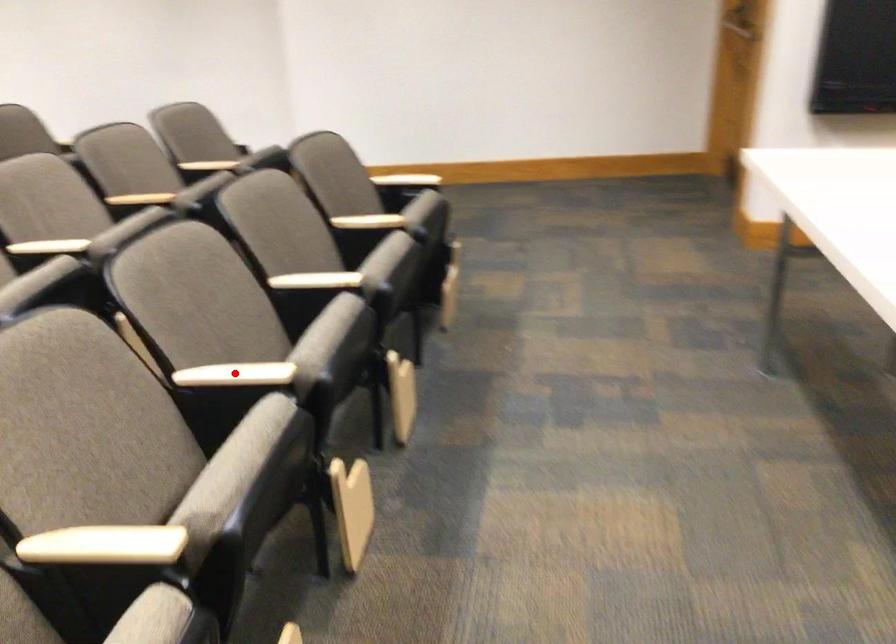
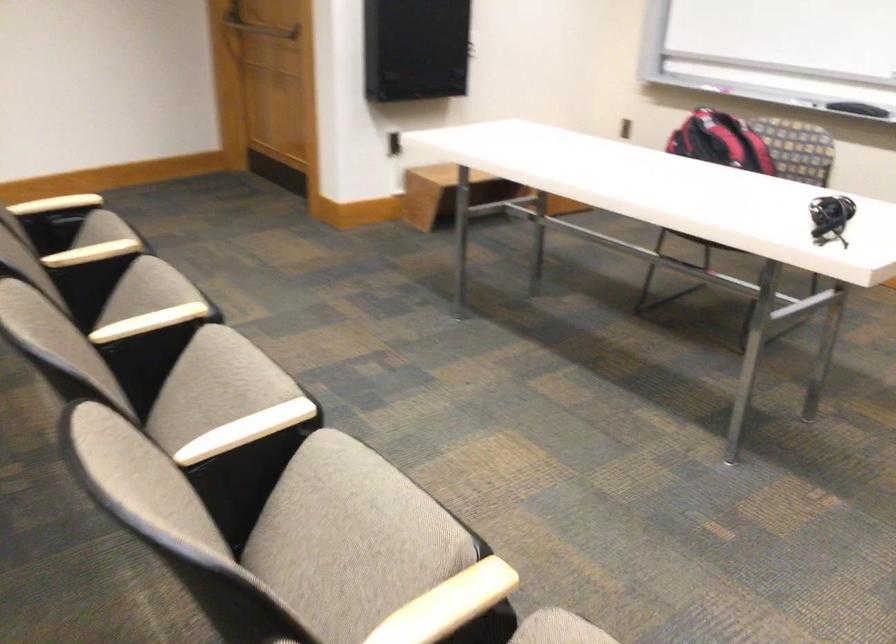
The point at the highlighted location is marked in the first image. Where is the corresponding point in the second image?

(245, 430)